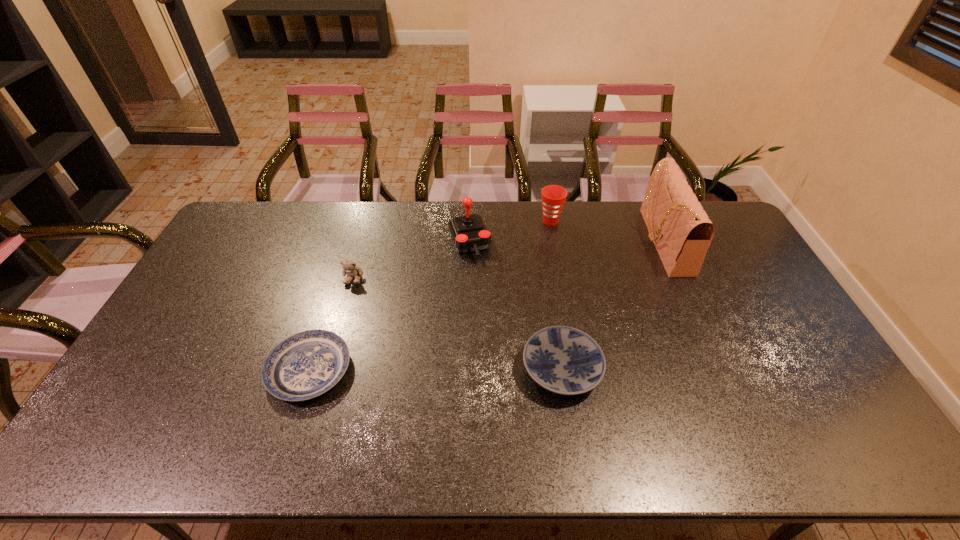
Find the location of a particular element. cup at the far edge is located at coordinates [553, 197].

The height and width of the screenshot is (540, 960). In the image, there is a desktop. Identify the location of free region at the far edge. (322, 224).

The image size is (960, 540). I want to click on vacant space at the near edge, so click(156, 460).

The image size is (960, 540). Identify the location of free space at the left edge of the desktop. (227, 280).

The image size is (960, 540). In order to click on free space at the near right corner in this screenshot , I will do `click(815, 457)`.

This screenshot has width=960, height=540. What are the coordinates of `blank region between the fourth tallest object and the fourth shortest object` in the screenshot? It's located at point(452,249).

Identify the location of vacant space in between the right plate and the cup. (x=556, y=295).

This screenshot has width=960, height=540. Identify the location of empty space that is in between the taller plate and the third shortest object. (458, 323).

This screenshot has width=960, height=540. In order to click on vacant area that lies between the fourth shortest object and the fourth tallest object in this screenshot , I will do `click(452, 249)`.

I want to click on empty space that is in between the handbag and the second shortest object, so click(612, 306).